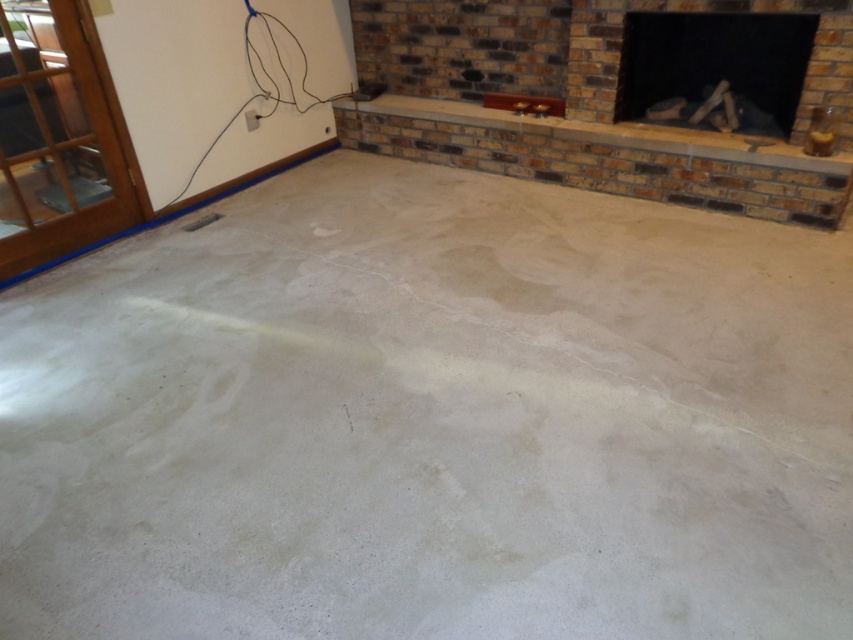
You are standing in the living room and see two points marked on the wall. The first is at point (589, 93) and the second is at point (641, 115). Which point is closer to you?

Point (589, 93) is closer to the viewer than point (641, 115).

You are standing in the living room and want to place a decorative item on the brick fireplace at upper center and the black brick fireplace at upper right. Which fireplace is positioned to the left side of the room?

The brick fireplace at upper center is positioned to the left of the black brick fireplace at upper right.

You are standing in the living room and want to place a decorative item on the brick fireplace at upper center and the black brick fireplace at upper right. Which fireplace will require you to move forward more to reach it?

The black brick fireplace at upper right requires moving forward more to reach it because it is further away from the viewer compared to the brick fireplace at upper center.